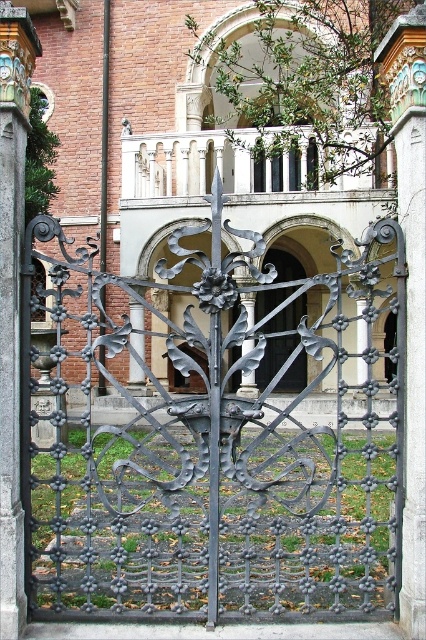
Question: Considering the relative positions of gray stone pillar at right and black wrought iron door at center in the image provided, where is gray stone pillar at right located with respect to black wrought iron door at center?

Choices:
 (A) left
 (B) right

Answer: (B)

Question: Can you confirm if black wrought iron gate at center is thinner than black wrought iron door at center?

Choices:
 (A) no
 (B) yes

Answer: (A)

Question: Which of the following is the farthest from the observer?

Choices:
 (A) (285, 348)
 (B) (8, 516)
 (C) (417, 196)
 (D) (115, 353)

Answer: (A)

Question: Estimate the real-world distances between objects in this image. Which object is farther from the black wrought iron door at center?

Choices:
 (A) gray stone pillar at right
 (B) black wrought iron gate at center
 (C) carved stone pillar at center

Answer: (C)

Question: Which of these objects is positioned farthest from the carved stone pillar at center?

Choices:
 (A) black wrought iron door at center
 (B) black wrought iron gate at center
 (C) gray stone pillar at right

Answer: (A)

Question: Does black wrought iron gate at center lie in front of black wrought iron door at center?

Choices:
 (A) no
 (B) yes

Answer: (B)